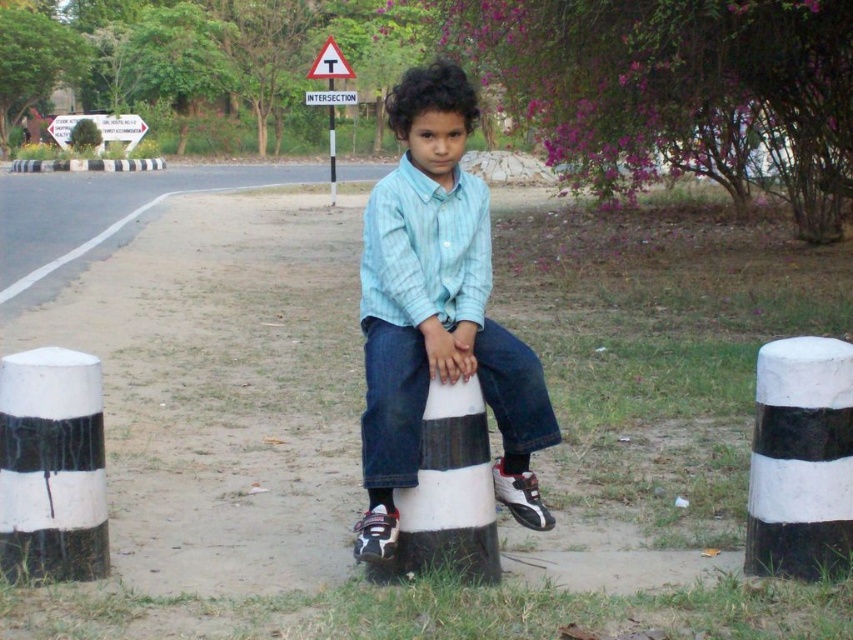
Looking at this image, can you confirm if black and white striped post at lower right is shorter than white striped pole at center?

Yes, black and white striped post at lower right is shorter than white striped pole at center.

Is point (837, 470) closer to camera compared to point (331, 104)?

That is True.

Is point (785, 524) closer to camera compared to point (335, 177)?

Yes, it is in front of point (335, 177).

Where is `black and white striped post at lower right`? The height and width of the screenshot is (640, 853). black and white striped post at lower right is located at coordinates (799, 458).

Can you confirm if light blue denim shirt at center is bigger than white plastic sign at upper center?

No, light blue denim shirt at center is not bigger than white plastic sign at upper center.

Can you confirm if light blue denim shirt at center is taller than white plastic sign at upper center?

No.

Is point (383, 374) closer to viewer compared to point (345, 96)?

Yes, it is.

You are a GUI agent. You are given a task and a screenshot of the screen. Output one action in this format:
    pyautogui.click(x=<x>, y=<y>)
    Task: Click on the light blue denim shirt at center
    The width and height of the screenshot is (853, 640).
    Given the screenshot: What is the action you would take?
    pyautogui.click(x=437, y=310)

Does light blue denim shirt at center appear under black and white striped post at center?

No.

The image size is (853, 640). I want to click on light blue denim shirt at center, so click(437, 310).